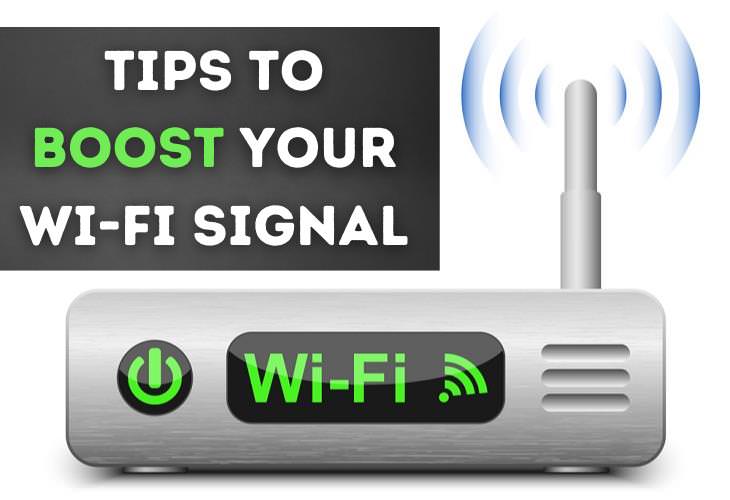
Where is `screen`? This screenshot has height=500, width=730. screen is located at coordinates (374, 405).